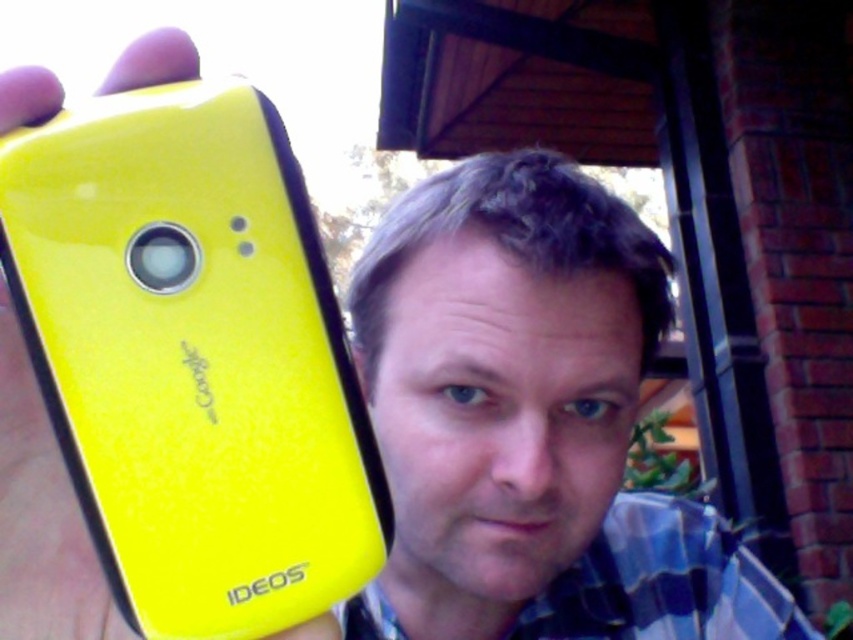
Question: Which of the following is the farthest from the observer?

Choices:
 (A) (389, 232)
 (B) (0, 394)

Answer: (A)

Question: Which point appears closest to the camera in this image?

Choices:
 (A) (28, 568)
 (B) (426, 228)

Answer: (A)

Question: Is the position of yellow matte phone at left less distant than that of matte yellow phone at upper left?

Choices:
 (A) no
 (B) yes

Answer: (B)

Question: Is yellow matte phone at left closer to camera compared to matte yellow phone at upper left?

Choices:
 (A) no
 (B) yes

Answer: (B)

Question: Is yellow matte phone at left to the right of matte yellow phone at upper left from the viewer's perspective?

Choices:
 (A) yes
 (B) no

Answer: (B)

Question: Which object is farther from the camera taking this photo?

Choices:
 (A) matte yellow phone at upper left
 (B) yellow matte phone at left

Answer: (A)